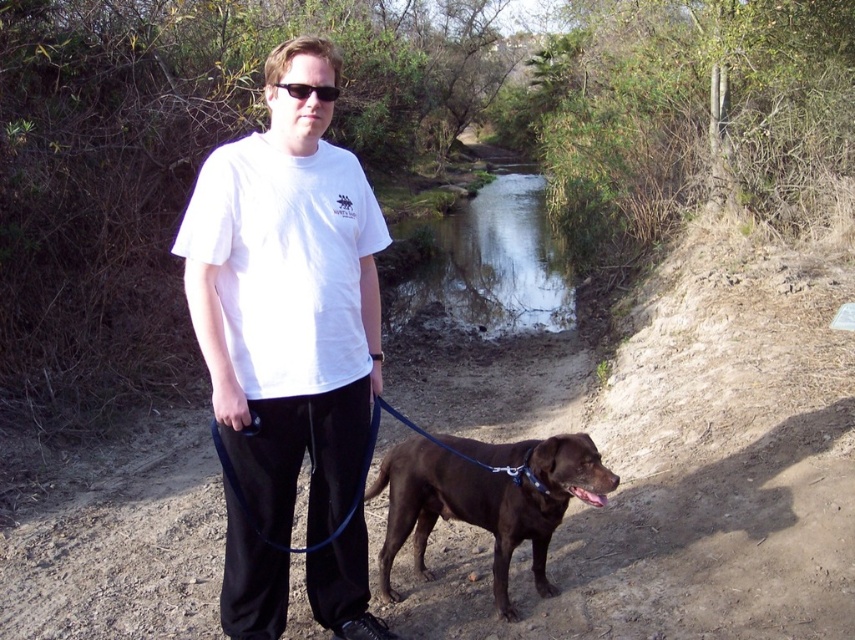
You are a photographer trying to capture the reflection of the clear water at center in your shot. Since the black plastic sunglasses at center might block the view, where should you position your camera relative to the sunglasses?

The clear water at center is above the black plastic sunglasses at center, so to capture the reflection without obstruction, position your camera above the sunglasses.